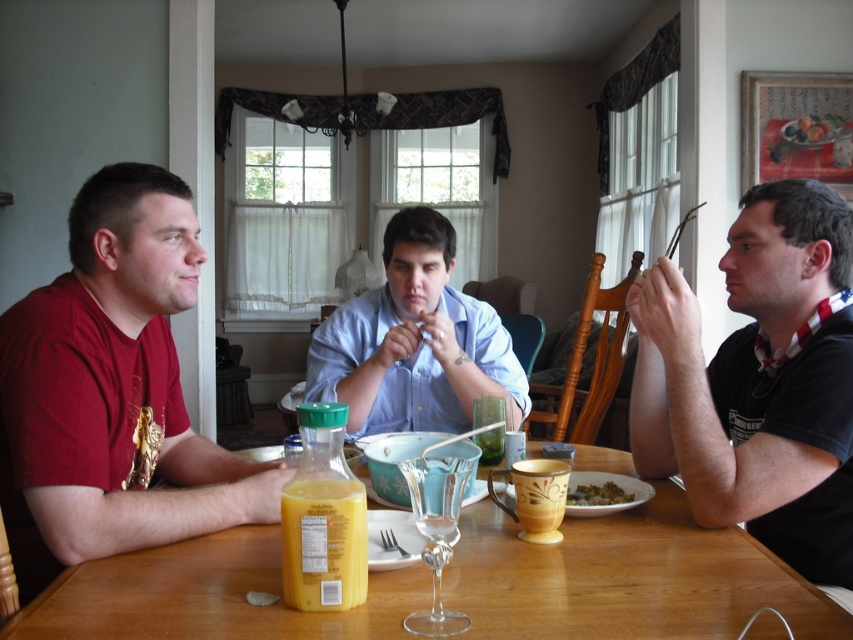
You are a waiter in a restaurant and you see the light blue shirt at center and the transparent glass wine glass at center. Which item is closer to the ceiling?

The light blue shirt at center is above the transparent glass wine glass at center, so it is closer to the ceiling.

You are a guest at this dining table and need to place a rectangular placemat that is 12 inches wide between the black matte shirt at right and the yellow matte bowl at lower center. Based on their widths, will the placemat fit between them?

The black matte shirt at right is wider than the yellow matte bowl at lower center. Since the placemat is 12 inches wide, it depends on the actual widths of the objects. However, the description only states the shirt is wider, not the exact measurements, so we cannot confirm if the placemat will fit without knowing the specific widths.

You are a guest at the table and want to pass a napkin from the yellow matte bowl at lower center to the person wearing the black matte shirt at right. Which direction should you move the napkin?

You should move the napkin to the right, as the black matte shirt at right is located to the right of the yellow matte bowl at lower center.